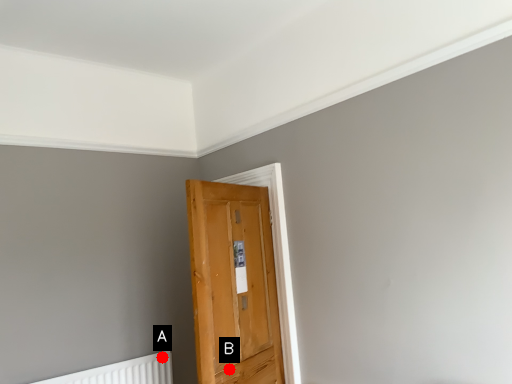
Question: Two points are circled on the image, labeled by A and B beside each circle. Among these points, which one is farthest from the camera?

Choices:
 (A) A is further
 (B) B is further

Answer: (A)